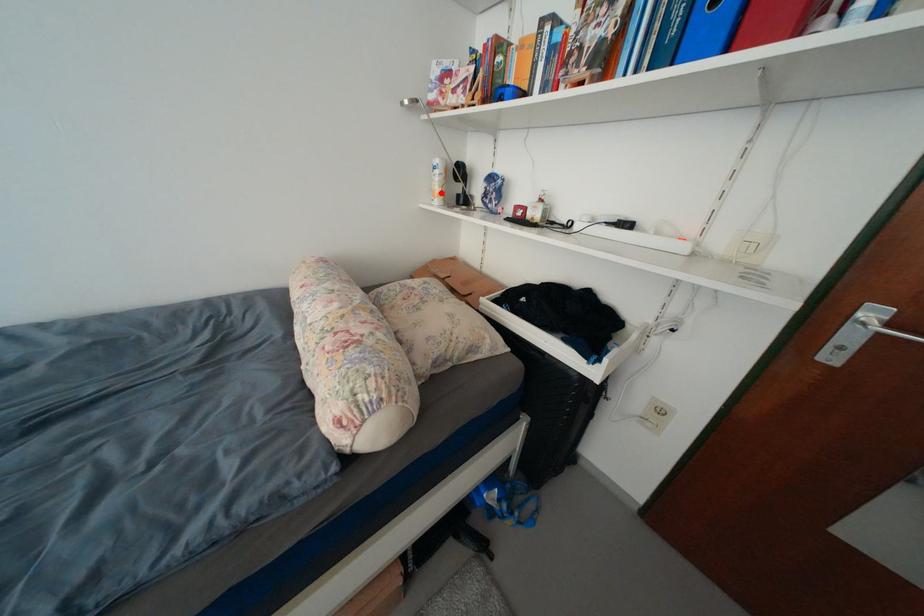
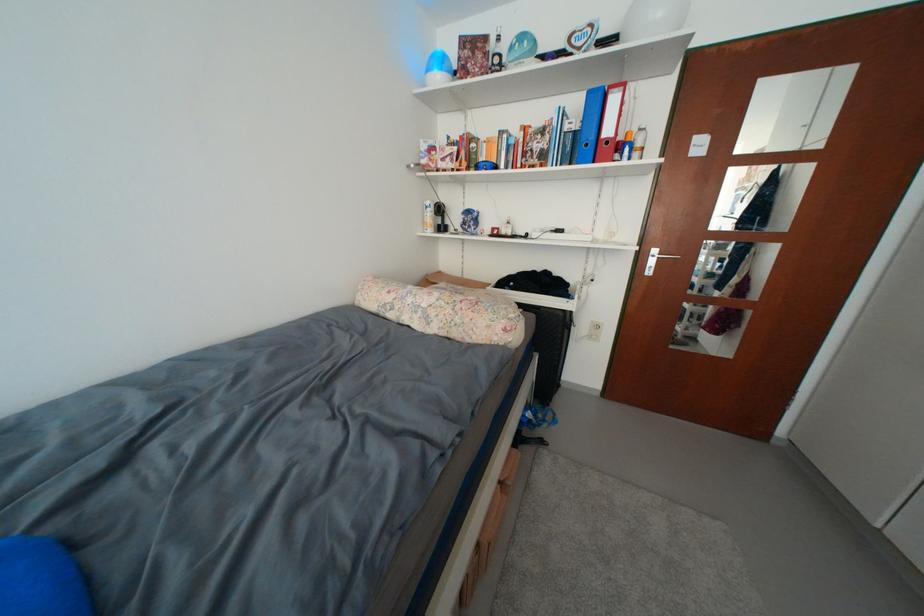
In the second image, find the point that corresponds to the highlighted location in the first image.

(432, 225)